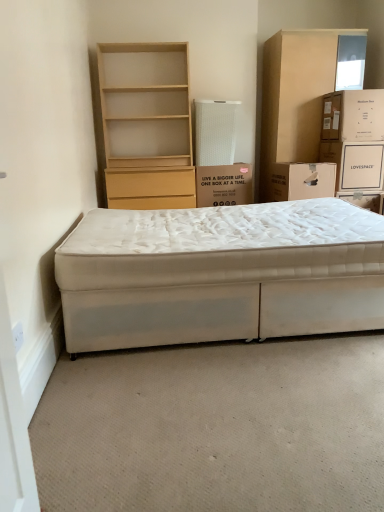
Question: Can you confirm if white fabric bed at lower center is positioned to the right of medium brown cardboard box at upper right, arranged as the 3th box when viewed from the left?

Choices:
 (A) no
 (B) yes

Answer: (A)

Question: Could you tell me if white fabric bed at lower center is turned towards medium brown cardboard box at upper right, placed as the 1th box when sorted from right to left?

Choices:
 (A) no
 (B) yes

Answer: (A)

Question: From the image's perspective, is white fabric bed at lower center beneath medium brown cardboard box at upper right, arranged as the 3th box when viewed from the left?

Choices:
 (A) yes
 (B) no

Answer: (A)

Question: Does white fabric bed at lower center contain medium brown cardboard box at upper right, placed as the 1th box when sorted from right to left?

Choices:
 (A) yes
 (B) no

Answer: (B)

Question: Does white fabric bed at lower center have a lesser width compared to medium brown cardboard box at upper right, placed as the 1th box when sorted from right to left?

Choices:
 (A) yes
 (B) no

Answer: (B)

Question: Considering the relative positions of white fabric bed at lower center and medium brown cardboard box at upper right, arranged as the 3th box when viewed from the left, in the image provided, is white fabric bed at lower center to the left of medium brown cardboard box at upper right, arranged as the 3th box when viewed from the left, from the viewer's perspective?

Choices:
 (A) no
 (B) yes

Answer: (B)

Question: Is medium brown cardboard box at upper right, placed as the 1th box when sorted from right to left, positioned with its back to white cardboard box at center, which is the first box in left-to-right order?

Choices:
 (A) no
 (B) yes

Answer: (A)

Question: Would you say white cardboard box at center, which is the first box in left-to-right order, is part of medium brown cardboard box at upper right, arranged as the 3th box when viewed from the left,'s contents?

Choices:
 (A) yes
 (B) no

Answer: (B)

Question: Does medium brown cardboard box at upper right, placed as the 1th box when sorted from right to left, appear on the right side of white cardboard box at center, the third box when ordered from right to left?

Choices:
 (A) yes
 (B) no

Answer: (A)

Question: Is medium brown cardboard box at upper right, arranged as the 3th box when viewed from the left, shorter than white cardboard box at center, the third box when ordered from right to left?

Choices:
 (A) no
 (B) yes

Answer: (B)

Question: Are medium brown cardboard box at upper right, placed as the 1th box when sorted from right to left, and white cardboard box at center, the third box when ordered from right to left, making contact?

Choices:
 (A) no
 (B) yes

Answer: (A)

Question: Is medium brown cardboard box at upper right, arranged as the 3th box when viewed from the left, taller than white cardboard box at center, the third box when ordered from right to left?

Choices:
 (A) yes
 (B) no

Answer: (B)

Question: Is the depth of white cardboard box at upper right less than that of beige cardboard cabinet at upper right?

Choices:
 (A) no
 (B) yes

Answer: (B)